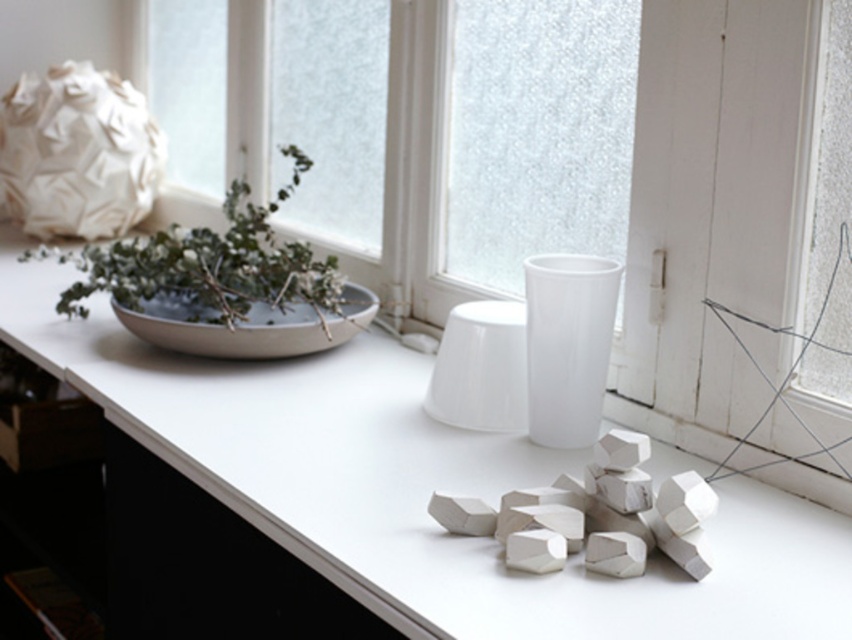
You are standing 2 feet away from the point at coordinates point (209, 474). Can you reach it without moving your feet?

The distance of point (209, 474) from viewer is 3.37 feet. Since you are standing 2 feet away from it, you are 2 feet away from the point (209, 474), which is within typical reaching distance. Therefore, you can reach it without moving your feet.

You are arranging a vase on the white matte counter top at center and want to ensure it faces the transparent glass window at upper center. Is the counter top positioned to the left or right of the window?

The white matte counter top at center is positioned on the left side of the transparent glass window at upper center, so placing the vase there will face it towards the window.

You are standing in front of the windowsill scene. There are two white ceramic items at point coordinates point (498, 259) and point (229, 321). Which of these points is closer to you?

Point (498, 259) is further to the viewer than point (229, 321), so the point closer to you is point (229, 321).